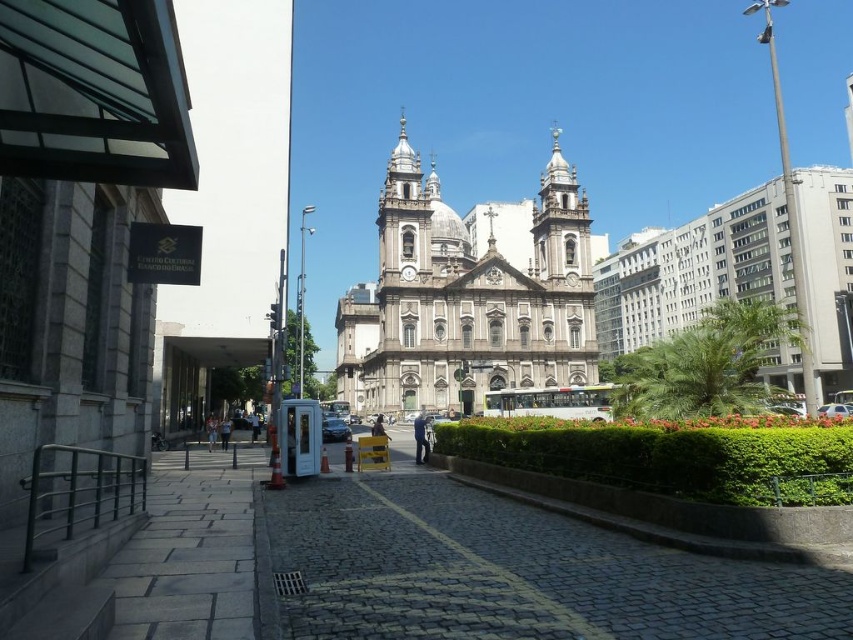
You are a tourist standing on the cobblestone street and want to take a photo of the white stone church at center without any obstructions. Is the black glossy car at center blocking your view of the church?

The black glossy car at center is behind the white stone church at center, so it does not block your view of the church. You can take the photo without any obstructions.

You are an architect analyzing the image. You notice two churches labeled as white marble church at center and white stone church at center. Which one has a greater width according to the description?

The white marble church at center has a greater width than the white stone church at center.

You are a tourist standing on the cobblestone street in front of the church. You want to take a photo of the white stone church at center without the black glossy car at center blocking the view. Where should you move to ensure the car is out of frame?

Move to the right side of the cobblestone street so that the black glossy car at center is no longer in the frame, allowing you to capture the white stone church at center clearly.